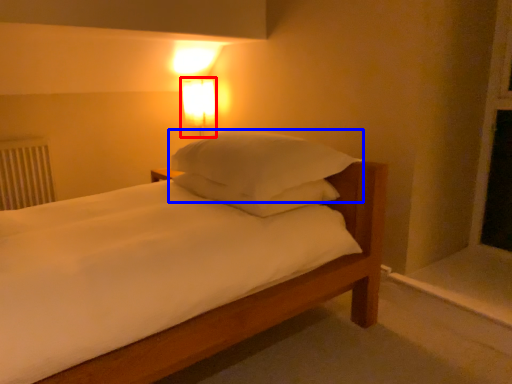
Question: Which point is closer to the camera, bedside lamp (highlighted by a red box) or pillow (highlighted by a blue box)?

Choices:
 (A) bedside lamp
 (B) pillow

Answer: (B)